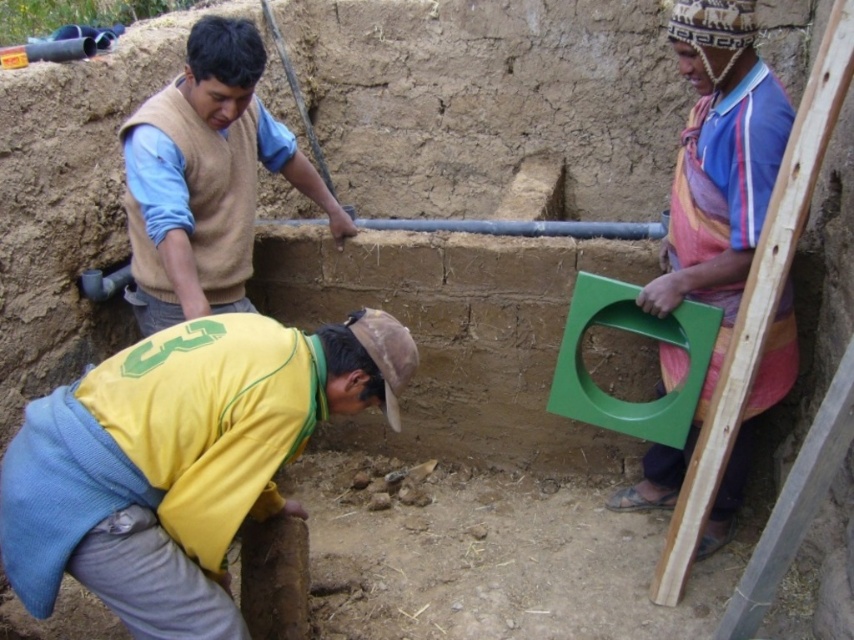
Question: Is yellow fabric at lower center closer to camera compared to green plastic frame at right?

Choices:
 (A) no
 (B) yes

Answer: (B)

Question: Can you confirm if yellow fabric at lower center is positioned to the right of beige wool sweater at upper left?

Choices:
 (A) yes
 (B) no

Answer: (A)

Question: Which point appears closest to the camera in this image?

Choices:
 (A) (237, 45)
 (B) (287, 420)
 (C) (726, 92)

Answer: (B)

Question: Estimate the real-world distances between objects in this image. Which object is closer to the yellow fabric at lower center?

Choices:
 (A) beige wool sweater at upper left
 (B) green plastic frame at right

Answer: (A)

Question: Which point is closer to the camera?

Choices:
 (A) (232, 204)
 (B) (683, 364)

Answer: (B)

Question: In this image, where is yellow fabric at lower center located relative to green plastic frame at right?

Choices:
 (A) left
 (B) right

Answer: (A)